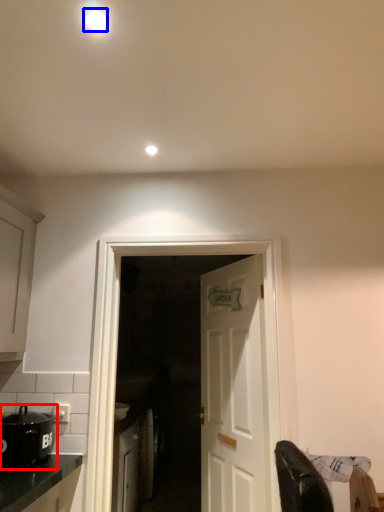
Question: Among these objects, which one is farthest to the camera, kitchen appliance (highlighted by a red box) or lighting (highlighted by a blue box)?

Choices:
 (A) kitchen appliance
 (B) lighting

Answer: (A)